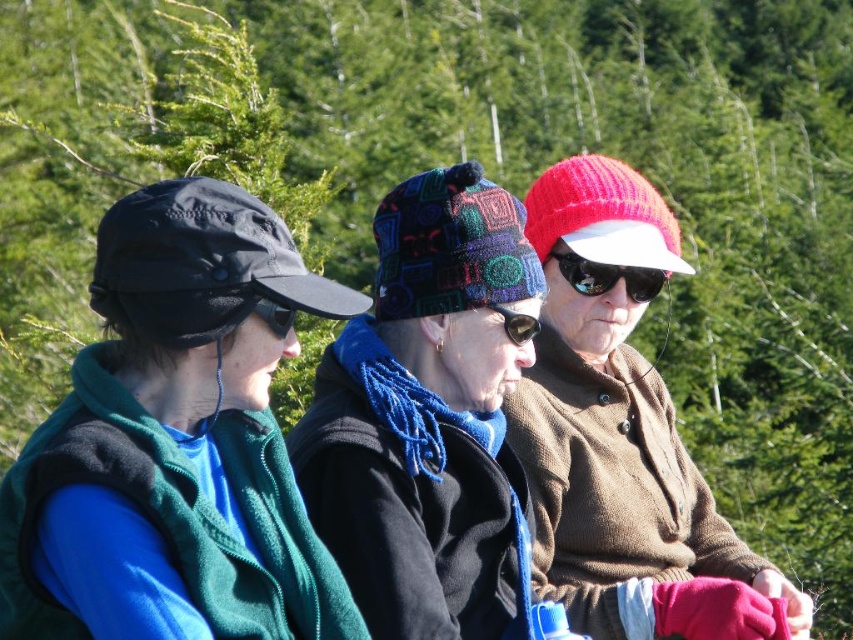
Who is positioned more to the left, knitted woolen hat at center or black reflective sunglasses at center?

knitted woolen hat at center is more to the left.

Does knitted woolen hat at center have a larger size compared to black reflective sunglasses at center?

Yes.

Between point (433, 529) and point (566, 250), which one is positioned in front?

Point (433, 529) is more forward.

Find the location of `knitted woolen hat at center`. knitted woolen hat at center is located at coordinates (427, 419).

The width and height of the screenshot is (853, 640). Describe the element at coordinates (175, 444) in the screenshot. I see `matte black cap at left` at that location.

Does matte black cap at left lie in front of knitted red hat at center?

Yes, matte black cap at left is closer to the viewer.

What do you see at coordinates (175, 444) in the screenshot? The height and width of the screenshot is (640, 853). I see `matte black cap at left` at bounding box center [175, 444].

Locate an element on the screen. The image size is (853, 640). matte black cap at left is located at coordinates (175, 444).

Does knitted woolen hat at center have a greater height compared to knitted red hat at center?

Indeed, knitted woolen hat at center has a greater height compared to knitted red hat at center.

Can you confirm if knitted woolen hat at center is bigger than knitted red hat at center?

Result: Correct, knitted woolen hat at center is larger in size than knitted red hat at center.

Is point (502, 237) behind point (612, 563)?

That is False.

Identify the location of knitted woolen hat at center. (427, 419).